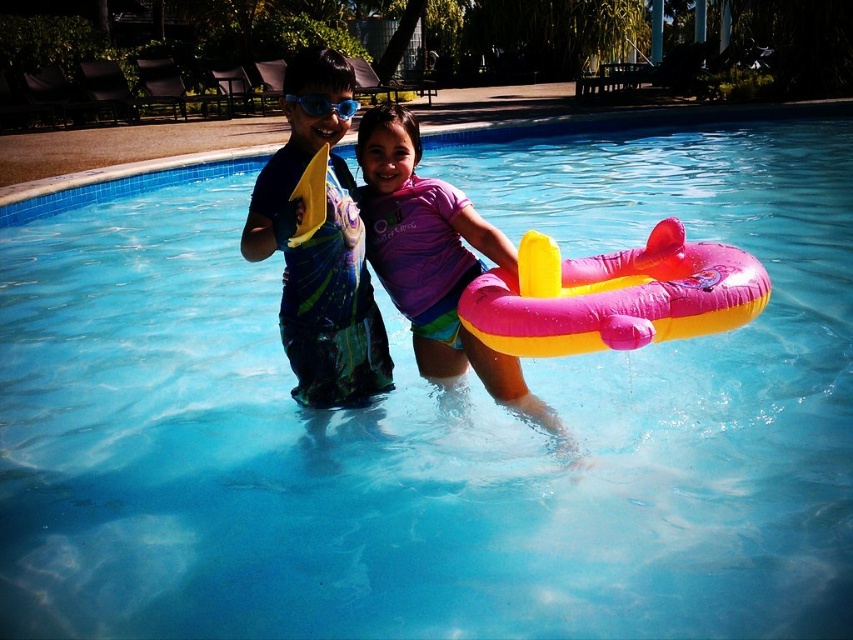
You are a lifeguard who needs to retrieve the pink rubber float at center and the blue matte goggles at upper center. If your reach is 4 feet, can you grab both items without moving from your current position?

The pink rubber float at center and blue matte goggles at upper center are 4.07 feet apart. Since your reach is only 4 feet, you cannot grab both items without moving from your current position.

You are a lifeguard who needs to choose an object to throw to a struggling swimmer. The pink rubber ring at center and the blue matte goggles at upper center are available. Which one is more suitable for the rescue?

The pink rubber ring at center is bigger than the blue matte goggles at upper center, making it more suitable for rescue as it provides better buoyancy and visibility.